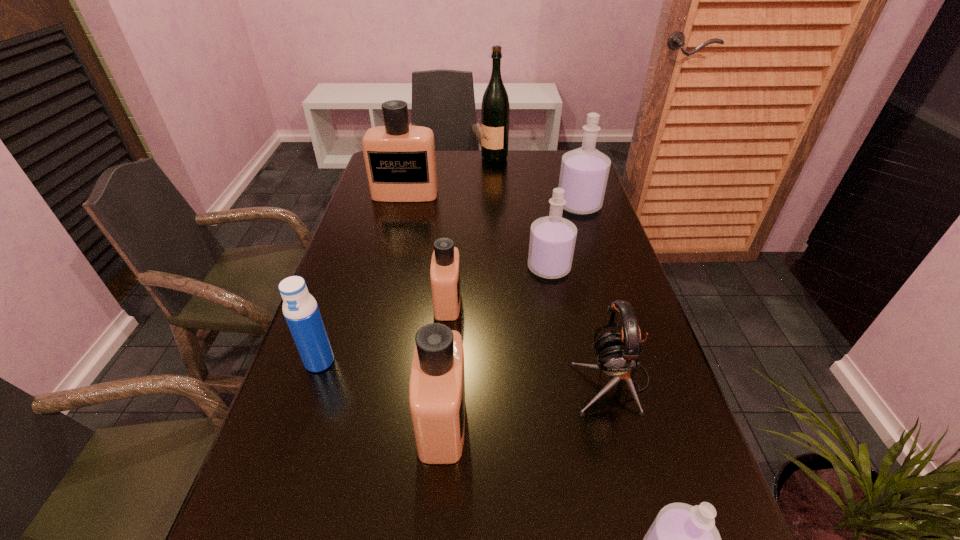
Identify the location of vacant space positioned 0.360m on the left of the earphone. (398, 381).

Identify the location of vacant area situated 0.240m on the front of the water bottle. (276, 489).

Where is `free location located 0.270m on the front label of the fourth farthest perfume`? Image resolution: width=960 pixels, height=540 pixels. free location located 0.270m on the front label of the fourth farthest perfume is located at coordinates (570, 302).

Where is `object located at the far edge`? Image resolution: width=960 pixels, height=540 pixels. object located at the far edge is located at coordinates (495, 110).

Locate an element on the screen. This screenshot has width=960, height=540. perfume that is at the left edge is located at coordinates (400, 159).

Where is `water bottle situated at the left edge`? Image resolution: width=960 pixels, height=540 pixels. water bottle situated at the left edge is located at coordinates (300, 309).

Where is `earphone that is at the right edge`? The height and width of the screenshot is (540, 960). earphone that is at the right edge is located at coordinates (618, 353).

Where is `free region at the far edge of the desktop`? free region at the far edge of the desktop is located at coordinates (484, 160).

This screenshot has height=540, width=960. I want to click on vacant space at the left edge of the desktop, so click(x=384, y=242).

I want to click on vacant space at the right edge of the desktop, so click(576, 252).